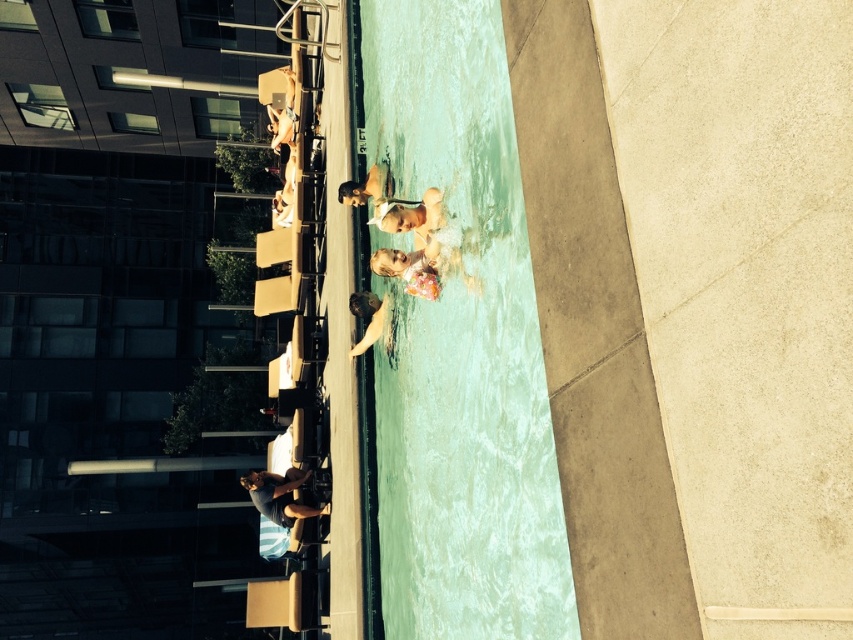
You are standing at the edge of the pool and want to reach both points marked in the image. Which point, point (360,308) or point (288,77), will you reach first as you walk towards them?

Point (360,308) is closer to the camera than point (288,77), so you will reach point (360,308) first.

You are standing at the edge of the pool and want to walk towards both the point at coordinates point (509, 317) and the point at coordinates point (442, 237). Which point will you reach first?

You will reach point (509, 317) first because it is closer to you than point (442, 237).